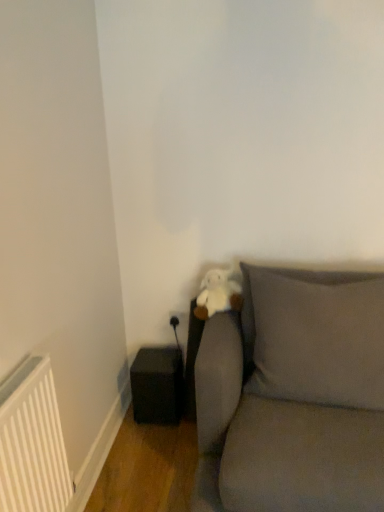
Image resolution: width=384 pixels, height=512 pixels. In order to click on blank space above black matte speaker at lower left (from a real-world perspective) in this screenshot , I will do `click(152, 359)`.